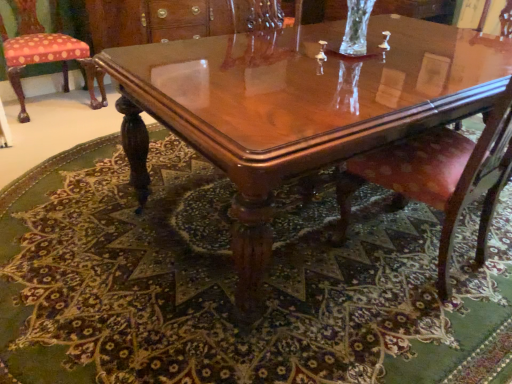
You are a GUI agent. You are given a task and a screenshot of the screen. Output one action in this format:
    pyautogui.click(x=<x>, y=<y>)
    Task: Click on the free space in front of polka dot fabric cushion at left, which appears as the 2th chair when ordered from the bottom
    Image resolution: width=512 pixels, height=384 pixels.
    Given the screenshot: What is the action you would take?
    pyautogui.click(x=41, y=130)